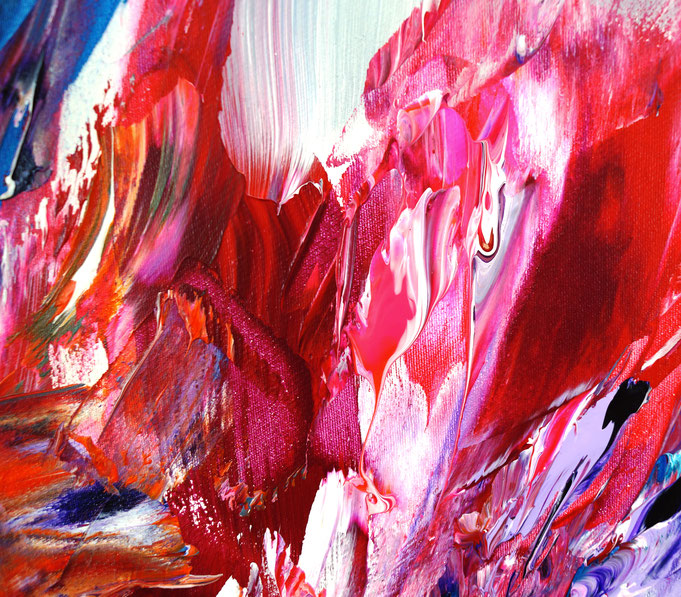
Locate an element on the screen. The image size is (681, 597). purple paint is located at coordinates (78, 29), (76, 46).